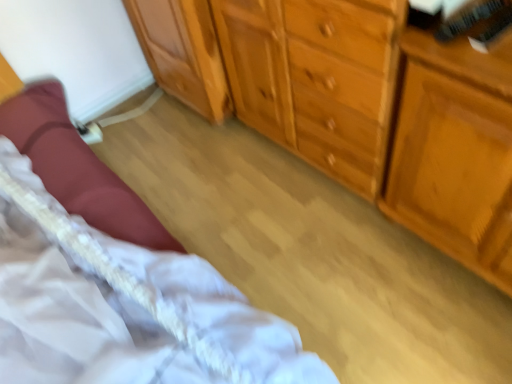
Question: Does wooden dresser at right have a greater width compared to wooden cabinet at center, the 1th cabinetry in the left-to-right sequence?

Choices:
 (A) no
 (B) yes

Answer: (A)

Question: Can you confirm if wooden dresser at right is bigger than wooden cabinet at center, positioned as the second cabinetry in right-to-left order?

Choices:
 (A) yes
 (B) no

Answer: (A)

Question: Would you say wooden cabinet at center, the 1th cabinetry in the left-to-right sequence, is part of wooden dresser at right's contents?

Choices:
 (A) no
 (B) yes

Answer: (A)

Question: Considering the relative sizes of wooden dresser at right and wooden cabinet at center, positioned as the second cabinetry in right-to-left order, in the image provided, is wooden dresser at right thinner than wooden cabinet at center, positioned as the second cabinetry in right-to-left order,?

Choices:
 (A) yes
 (B) no

Answer: (A)

Question: Considering the relative positions of wooden dresser at right and wooden cabinet at center, the 1th cabinetry in the left-to-right sequence, in the image provided, is wooden dresser at right in front of wooden cabinet at center, the 1th cabinetry in the left-to-right sequence,?

Choices:
 (A) yes
 (B) no

Answer: (A)

Question: From the image's perspective, is white lace bed at lower left positioned above or below wooden dresser at right?

Choices:
 (A) below
 (B) above

Answer: (A)

Question: In terms of size, does white lace bed at lower left appear bigger or smaller than wooden dresser at right?

Choices:
 (A) small
 (B) big

Answer: (B)

Question: Is white lace bed at lower left taller or shorter than wooden dresser at right?

Choices:
 (A) tall
 (B) short

Answer: (B)

Question: Considering the positions of point (271, 357) and point (408, 206), is point (271, 357) closer or farther from the camera than point (408, 206)?

Choices:
 (A) closer
 (B) farther

Answer: (A)

Question: Looking at their shapes, would you say wooden chest of drawers at center is wider or thinner than white lace bed at lower left?

Choices:
 (A) wide
 (B) thin

Answer: (A)

Question: Is point (232, 51) positioned closer to the camera than point (170, 256)?

Choices:
 (A) farther
 (B) closer

Answer: (A)

Question: Considering their positions, is wooden chest of drawers at center located in front of or behind white lace bed at lower left?

Choices:
 (A) front
 (B) behind

Answer: (A)

Question: Which is correct: wooden chest of drawers at center is inside white lace bed at lower left, or outside of it?

Choices:
 (A) inside
 (B) outside

Answer: (A)

Question: Would you say wooden cabinet at center, the 1th cabinetry in the left-to-right sequence, is inside or outside white lace bed at lower left?

Choices:
 (A) outside
 (B) inside

Answer: (A)

Question: Visually, is wooden cabinet at center, the 1th cabinetry in the left-to-right sequence, positioned to the left or to the right of white lace bed at lower left?

Choices:
 (A) left
 (B) right

Answer: (B)